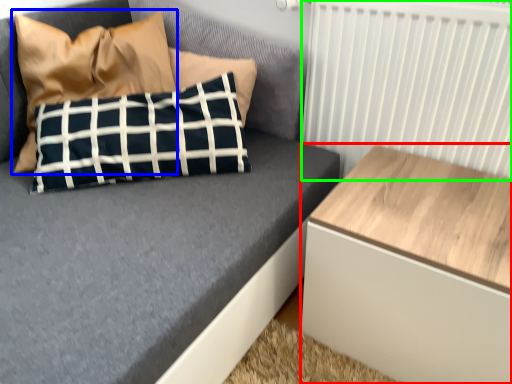
Question: Which object is the closest to the table (highlighted by a red box)? Choose among these: pillow (highlighted by a blue box) or radiator (highlighted by a green box).

Choices:
 (A) pillow
 (B) radiator

Answer: (B)